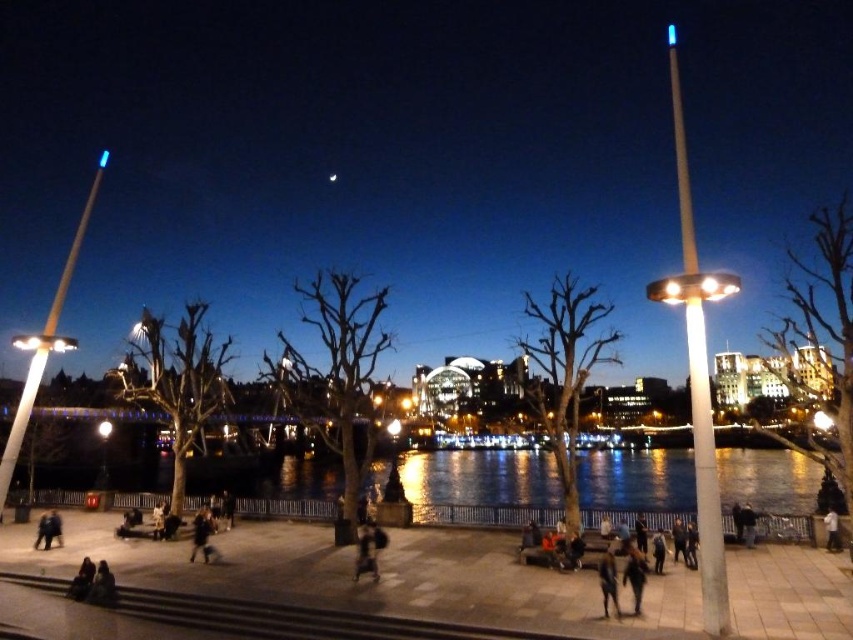
Is black matte jacket at lower center bigger than dark blue jeans at lower center?

Correct, black matte jacket at lower center is larger in size than dark blue jeans at lower center.

Is black matte jacket at lower center positioned behind dark blue jeans at lower center?

No, black matte jacket at lower center is closer to the viewer.

Does point (628, 556) lie behind point (602, 570)?

Yes.

The image size is (853, 640). Find the location of `black matte jacket at lower center`. black matte jacket at lower center is located at coordinates (634, 573).